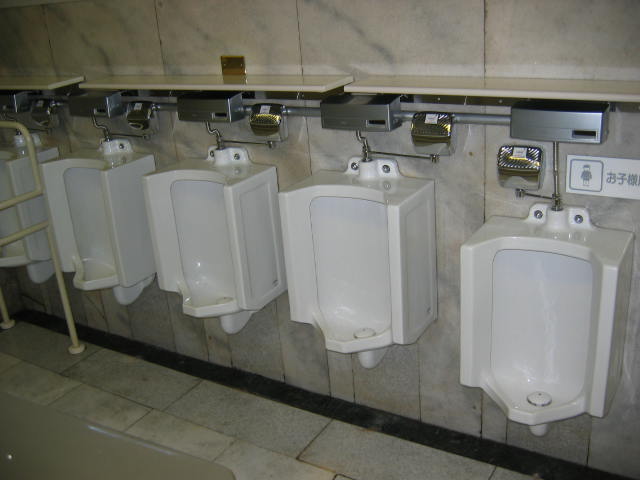
You are a GUI agent. You are given a task and a screenshot of the screen. Output one action in this format:
    pyautogui.click(x=<x>, y=<y>)
    Task: Click on the urinals
    The height and width of the screenshot is (480, 640).
    Given the screenshot: What is the action you would take?
    pyautogui.click(x=541, y=305), pyautogui.click(x=365, y=240), pyautogui.click(x=210, y=215), pyautogui.click(x=120, y=206), pyautogui.click(x=28, y=184)